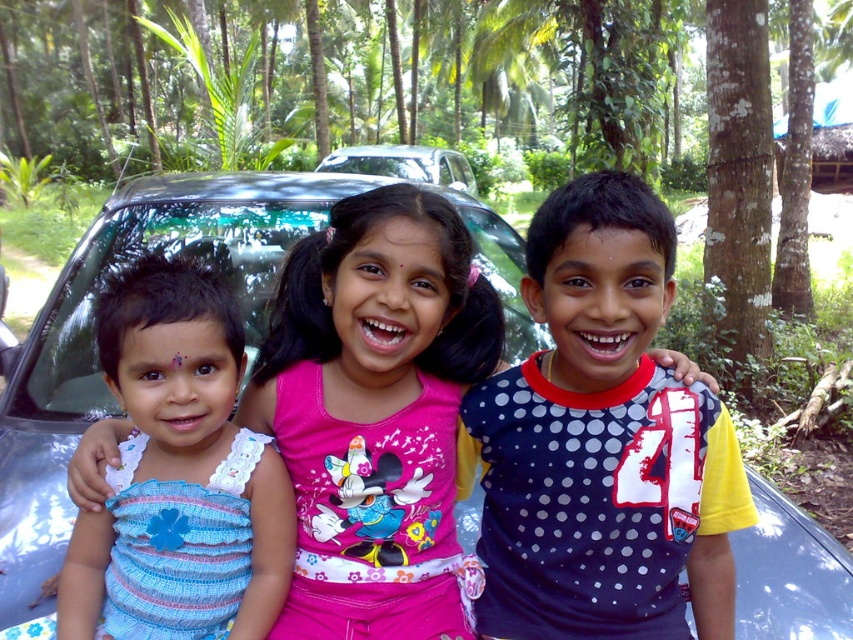
You are a photographer trying to capture a clear shot of the metallic blue car at center. However, the pink fabric shirt at center is blocking your view. Based on the scene, can you determine if the car is above or below the shirt?

The pink fabric shirt at center is positioned under the metallic blue car at center, so the metallic blue car at center is above the pink fabric shirt at center.

Based on the scene description, if you were to look at the image from the front, which object is positioned lower between the blue striped dress at left and the satin black car at center?

The blue striped dress at left is located below the satin black car at center, so it is positioned lower.